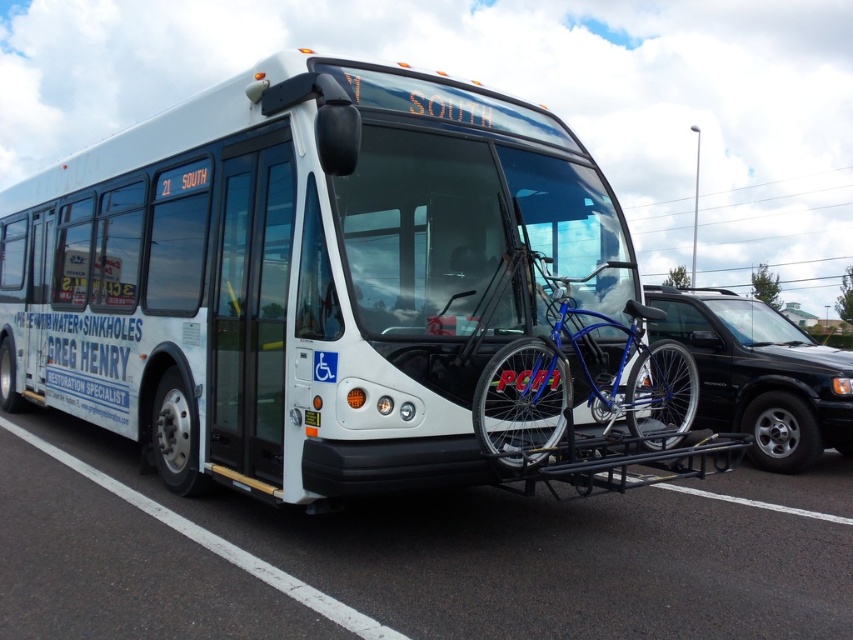
Question: Among these points, which one is farthest from the camera?

Choices:
 (A) (683, 387)
 (B) (706, 372)
 (C) (212, 618)
 (D) (434, 378)

Answer: (B)

Question: Which point appears closest to the camera in this image?

Choices:
 (A) (440, 419)
 (B) (648, 444)
 (C) (827, 352)

Answer: (A)

Question: Which is farther from the black matte suv at right?

Choices:
 (A) blue metallic bicycle at center
 (B) white matte bus at center

Answer: (B)

Question: Does white matte bus at center appear under black matte suv at right?

Choices:
 (A) yes
 (B) no

Answer: (B)

Question: Does blue metallic bicycle at center appear on the right side of black matte suv at right?

Choices:
 (A) yes
 (B) no

Answer: (B)

Question: Can you confirm if white matte bus at center is wider than black asphalt at lower center?

Choices:
 (A) no
 (B) yes

Answer: (A)